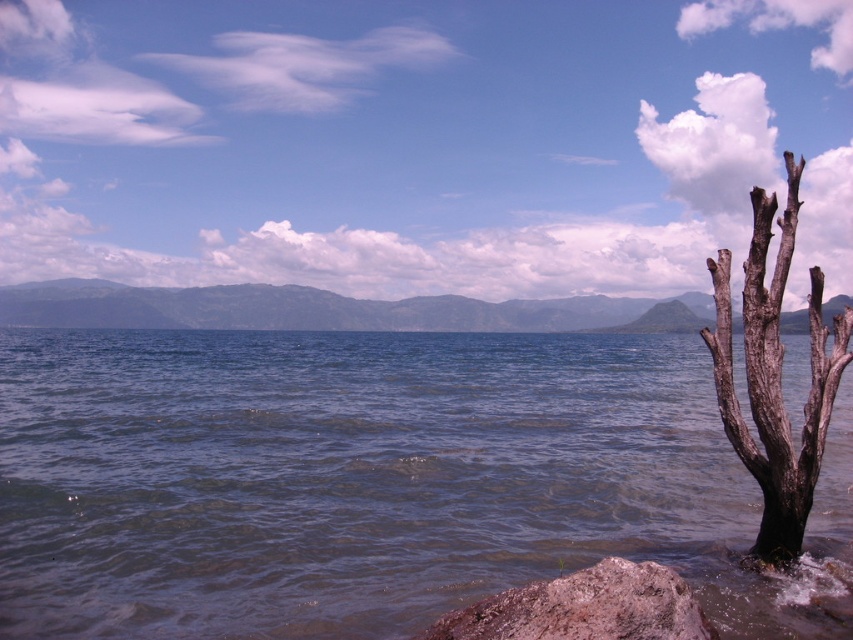
Does point (518, 538) come behind point (833, 365)?

Yes.

The height and width of the screenshot is (640, 853). Describe the element at coordinates (376, 481) in the screenshot. I see `clear water at lower left` at that location.

Where is `clear water at lower left`? This screenshot has height=640, width=853. clear water at lower left is located at coordinates 376,481.

Locate an element on the screen. The image size is (853, 640). clear water at lower left is located at coordinates pos(376,481).

Does dark brown bark tree at right appear on the left side of rusty rock at lower right?

No, dark brown bark tree at right is not to the left of rusty rock at lower right.

Does dark brown bark tree at right appear on the right side of rusty rock at lower right?

Yes, dark brown bark tree at right is to the right of rusty rock at lower right.

Identify the location of dark brown bark tree at right. (775, 374).

Is point (219, 470) positioned before point (485, 618)?

No, it is not.

Does clear water at lower left have a greater height compared to rusty rock at lower right?

Yes, clear water at lower left is taller than rusty rock at lower right.

In the scene shown: Who is more forward, (90, 506) or (573, 611)?

Point (573, 611) is in front.

Where is `clear water at lower left`? The height and width of the screenshot is (640, 853). clear water at lower left is located at coordinates (376, 481).